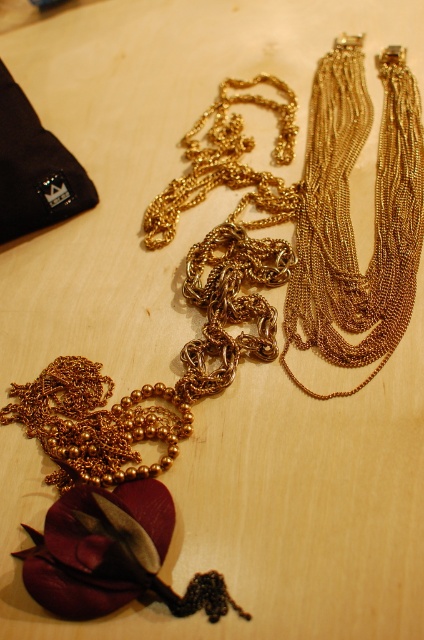
You are organizing a display and need to know which object takes up more space. Which is bigger, the gold chain at upper right or the satin burgundy flower at center?

The gold chain at upper right is larger in size than the satin burgundy flower at center, so the gold chain at upper right takes up more space.

Please provide the exact coordinates of the gold chain at upper right in the image. The coordinate system has the origin at the bottom left corner of the image, with x increasing to the right and y increasing upward.

Result: The gold chain at upper right is located at coordinates point (349, 216).

You are an interior designer arranging a display. You have a gold chain at upper right and a satin burgundy flower at center. From the viewer perspective, which object appears closer?

The gold chain at upper right appears closer to the viewer because the satin burgundy flower at center is positioned behind it.